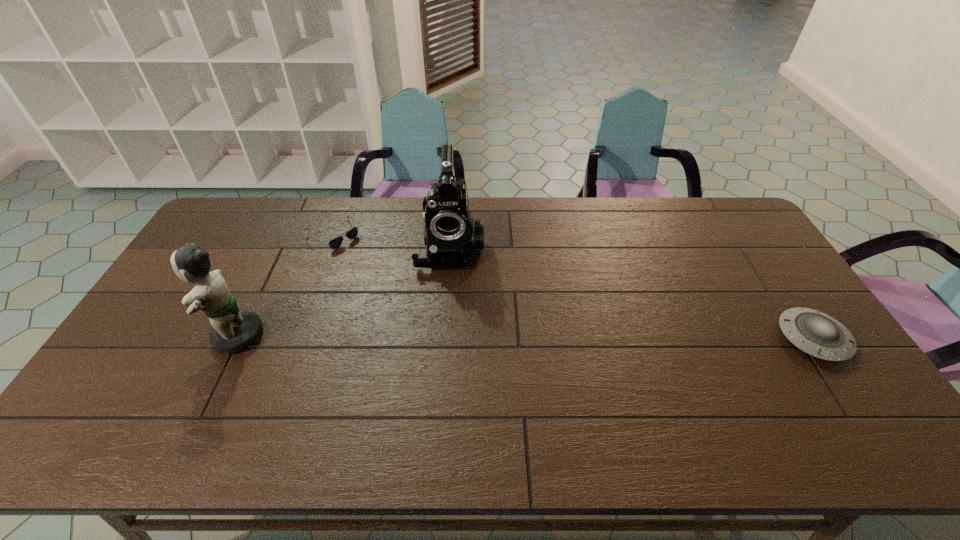
In order to click on the second closest object relative to the saucer in this screenshot , I will do `click(335, 243)`.

You are a GUI agent. You are given a task and a screenshot of the screen. Output one action in this format:
    pyautogui.click(x=<x>, y=<y>)
    Task: Click on the object that stands as the second closest to the rightmost object
    This screenshot has width=960, height=540.
    Given the screenshot: What is the action you would take?
    pyautogui.click(x=335, y=243)